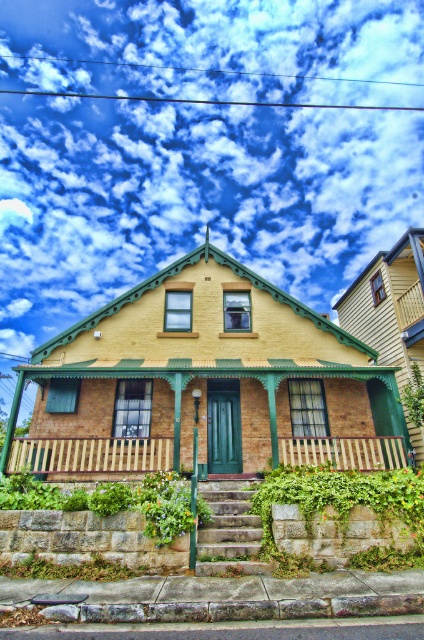
Question: Is cloudy sky at upper center behind wooden slats at lower center?

Choices:
 (A) no
 (B) yes

Answer: (B)

Question: Estimate the real-world distances between objects in this image. Which object is farther from the wooden at center?

Choices:
 (A) cloudy sky at upper center
 (B) wooden slats at lower center
 (C) wooden planks at center

Answer: (A)

Question: Among these points, which one is nearest to the camera?

Choices:
 (A) (89, 448)
 (B) (142, 438)
 (C) (36, 161)

Answer: (B)

Question: Which point is closer to the camera taking this photo?

Choices:
 (A) (390, 460)
 (B) (70, 460)
 (C) (80, 12)
 (D) (382, 454)

Answer: (A)

Question: Can you confirm if cloudy sky at upper center is positioned to the left of wooden planks at center?

Choices:
 (A) no
 (B) yes

Answer: (A)

Question: Can you confirm if wooden slats at lower center is wider than wooden at center?

Choices:
 (A) no
 (B) yes

Answer: (B)